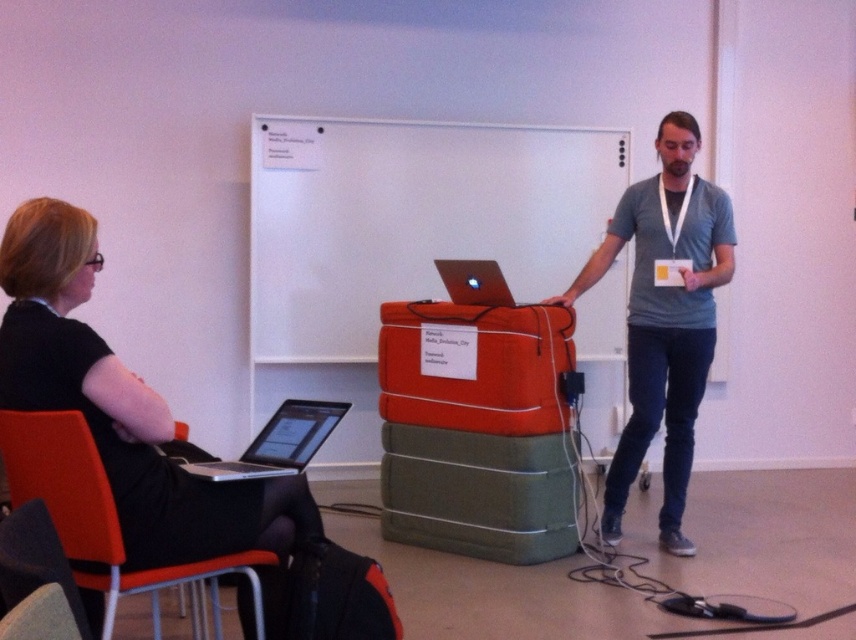
Question: Does orange plastic chair at lower left appear over silver metallic laptop at lower left?

Choices:
 (A) yes
 (B) no

Answer: (B)

Question: Which of the following is the farthest from the observer?

Choices:
 (A) orange fabric suitcase at lower center
 (B) shiny silver laptop at center
 (C) silver metallic laptop at lower left
 (D) white matte board at upper center

Answer: (D)

Question: Can you confirm if orange fabric suitcase at center is positioned above orange fabric suitcase at lower center?

Choices:
 (A) yes
 (B) no

Answer: (A)

Question: Which object is farther from the camera taking this photo?

Choices:
 (A) orange fabric suitcase at lower center
 (B) orange plastic chair at lower left
 (C) silver metallic laptop at lower left

Answer: (A)

Question: Is black fabric dress at left above silver metallic laptop at lower left?

Choices:
 (A) yes
 (B) no

Answer: (A)

Question: Considering the real-world distances, which object is closest to the black fabric dress at left?

Choices:
 (A) orange plastic chair at lower left
 (B) silver metallic laptop at lower left

Answer: (A)